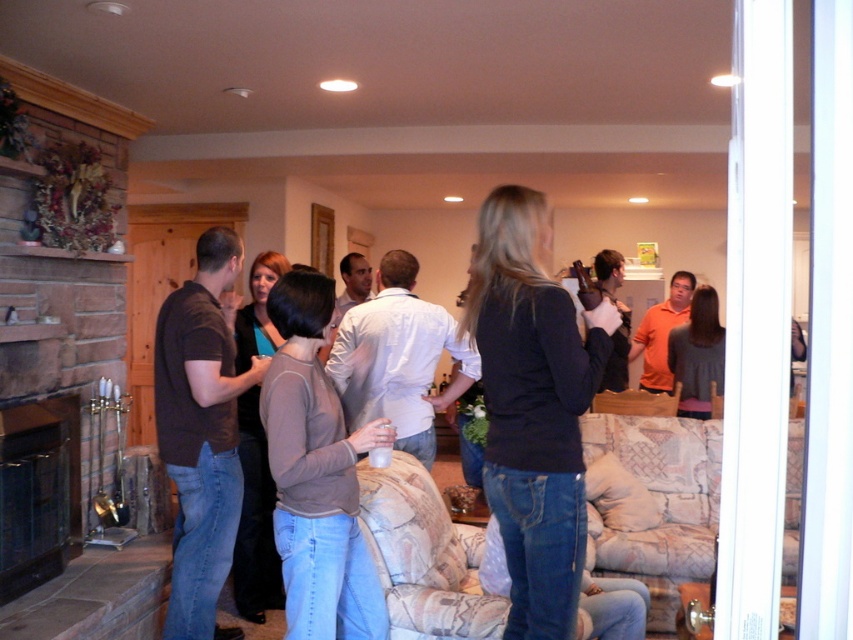
You are at a party and want to move from the black stone fireplace at lower left to the orange cotton shirt at center. Which direction should you move in?

Since the black stone fireplace at lower left is positioned on the left side of orange cotton shirt at center, you should move to the right to reach the orange cotton shirt at center.

In the scene shown: You are at the point marked by the coordinates (316, 474) in the image. What object are you standing on?

The point at coordinates (316, 474) is on the light brown sweater at center.

You are a guest at this party and want to take a photo of the black stone fireplace at lower left and the orange cotton shirt at center together in the frame. Which object should you position closer to the camera to ensure both are in focus?

The black stone fireplace at lower left is not as tall as the orange cotton shirt at center, so you should position the camera closer to the orange cotton shirt at center to ensure both are in focus.